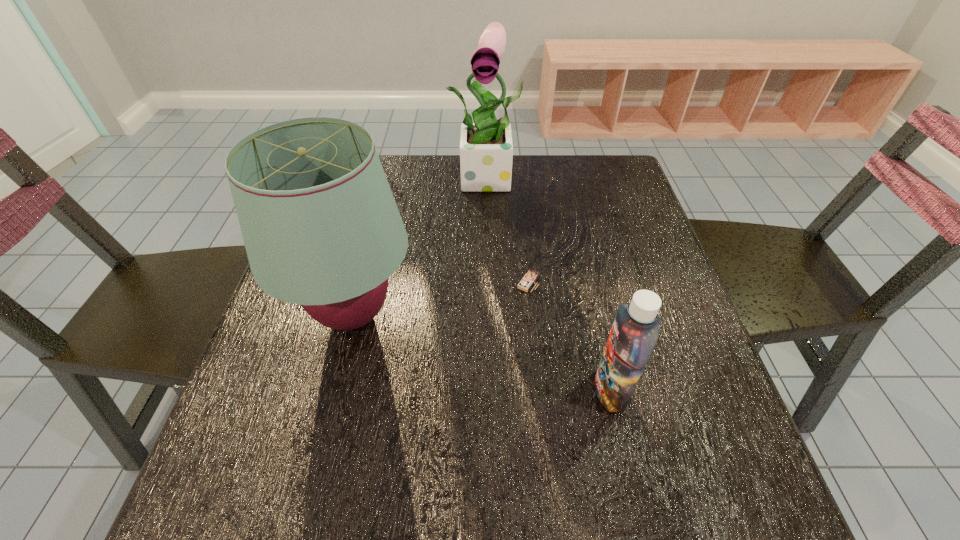
The height and width of the screenshot is (540, 960). Identify the location of free spot between the leftmost object and the shortest object. (441, 298).

Locate an element on the screen. The image size is (960, 540). vacant space that's between the leftmost object and the shampoo is located at coordinates (482, 352).

The height and width of the screenshot is (540, 960). What are the coordinates of `unoccupied area between the farthest object and the rightmost object` in the screenshot? It's located at (551, 284).

I want to click on vacant area that lies between the flower arrangement and the lampshade, so click(x=421, y=246).

Find the location of `free area in between the lampshade and the shortest object`. free area in between the lampshade and the shortest object is located at coordinates (441, 298).

This screenshot has width=960, height=540. I want to click on vacant point located between the shortest object and the flower arrangement, so click(x=510, y=230).

Locate an element on the screen. The image size is (960, 540). free space between the flower arrangement and the shampoo is located at coordinates [551, 284].

Locate an element on the screen. vacant point located between the matchbox and the flower arrangement is located at coordinates (510, 230).

You are a GUI agent. You are given a task and a screenshot of the screen. Output one action in this format:
    pyautogui.click(x=<x>, y=<y>)
    Task: Click on the third closest object to the farthest object
    This screenshot has width=960, height=540.
    Given the screenshot: What is the action you would take?
    pyautogui.click(x=636, y=327)

Locate which object ranks in proximity to the second shortest object. Please provide its 2D coordinates. Your answer should be formatted as a tuple, i.e. [(x, y)], where the tuple contains the x and y coordinates of a point satisfying the conditions above.

[(528, 280)]